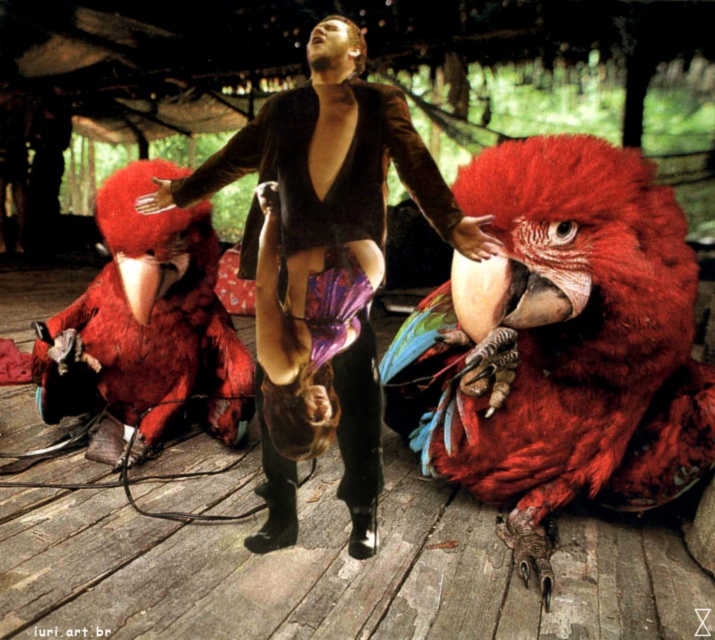
Question: Does velvet brown jacket at center appear on the left side of shiny red parrot at left?

Choices:
 (A) yes
 (B) no

Answer: (B)

Question: Among these objects, which one is nearest to the camera?

Choices:
 (A) velvet brown jacket at center
 (B) shiny red parrot at left

Answer: (A)

Question: Among these objects, which one is farthest from the camera?

Choices:
 (A) shiny red parrot at left
 (B) shiny red parrot at center
 (C) velvet brown jacket at center

Answer: (A)

Question: Can you confirm if velvet brown jacket at center is positioned above shiny red parrot at left?

Choices:
 (A) no
 (B) yes

Answer: (B)

Question: Considering the relative positions of shiny red parrot at center and velvet brown jacket at center in the image provided, where is shiny red parrot at center located with respect to velvet brown jacket at center?

Choices:
 (A) below
 (B) above

Answer: (A)

Question: Which point is farther to the camera?

Choices:
 (A) (286, 408)
 (B) (485, 387)

Answer: (B)